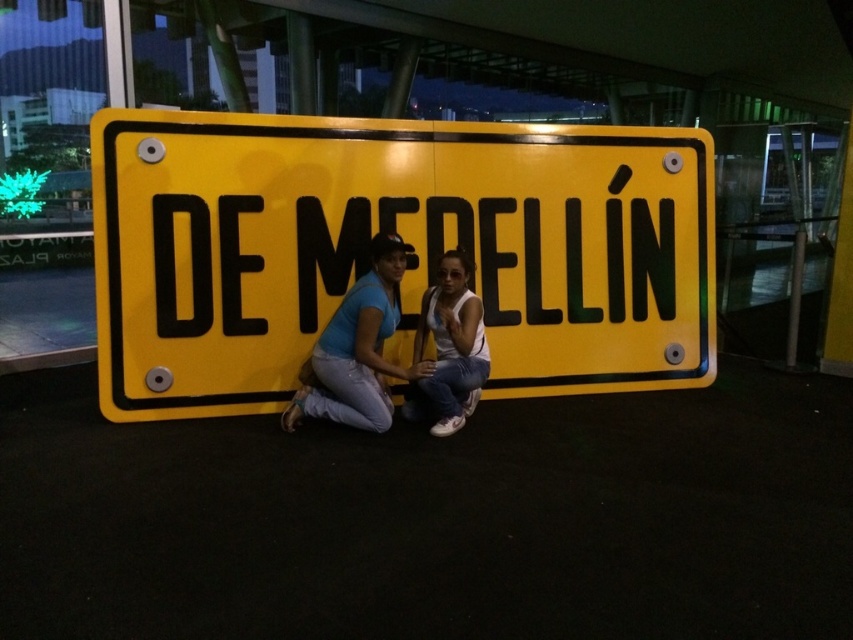
Question: Can you confirm if yellow metallic sign at center is positioned to the right of matte black clothing at center?

Choices:
 (A) no
 (B) yes

Answer: (B)

Question: Among these objects, which one is nearest to the camera?

Choices:
 (A) matte black clothing at center
 (B) yellow metallic sign at center

Answer: (A)

Question: Is yellow metallic sign at center wider than white matte tank top at center?

Choices:
 (A) no
 (B) yes

Answer: (B)

Question: Which point is farther to the camera?

Choices:
 (A) matte black clothing at center
 (B) white matte tank top at center
 (C) yellow metallic sign at center

Answer: (C)

Question: Can you confirm if yellow metallic sign at center is bigger than white matte tank top at center?

Choices:
 (A) yes
 (B) no

Answer: (A)

Question: Which point is closer to the camera taking this photo?

Choices:
 (A) (660, 216)
 (B) (442, 282)
 (C) (370, 417)

Answer: (C)